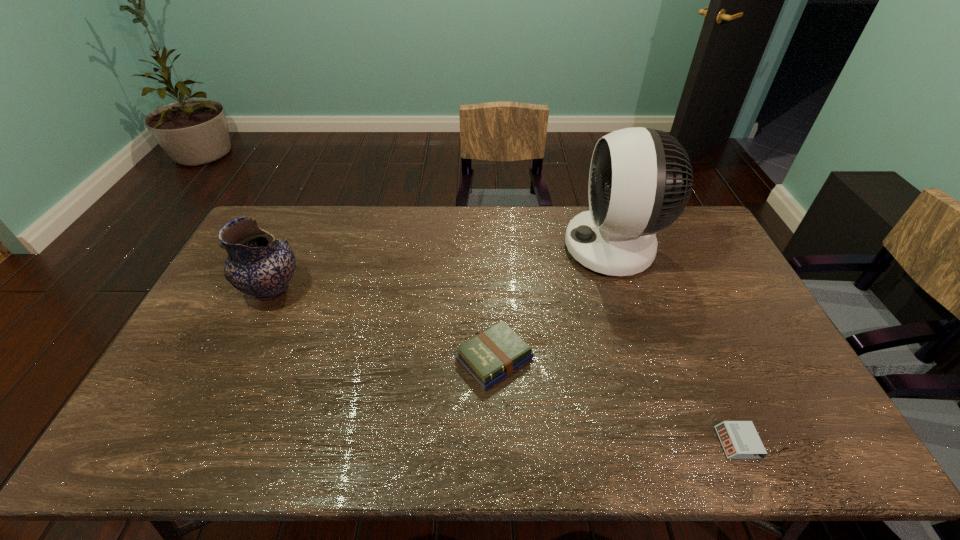
The height and width of the screenshot is (540, 960). Find the location of `the tallest object`. the tallest object is located at coordinates (640, 179).

The image size is (960, 540). Identify the location of pottery. (258, 264).

Find the location of a particular element. This screenshot has width=960, height=540. the third shortest object is located at coordinates (258, 264).

Where is `the second nearest object`? The image size is (960, 540). the second nearest object is located at coordinates (495, 353).

Find the location of `the third tallest object`. the third tallest object is located at coordinates (495, 353).

Where is `alarm clock`? alarm clock is located at coordinates (740, 440).

Identify the location of the nearest object. This screenshot has height=540, width=960. (740, 440).

The image size is (960, 540). What are the coordinates of `blank space located on the grille of the fan` in the screenshot? It's located at (514, 248).

Locate an element on the screen. This screenshot has height=540, width=960. vacant space located on the grille of the fan is located at coordinates (525, 248).

The height and width of the screenshot is (540, 960). I want to click on free space located 0.370m on the grille of the fan, so click(x=460, y=248).